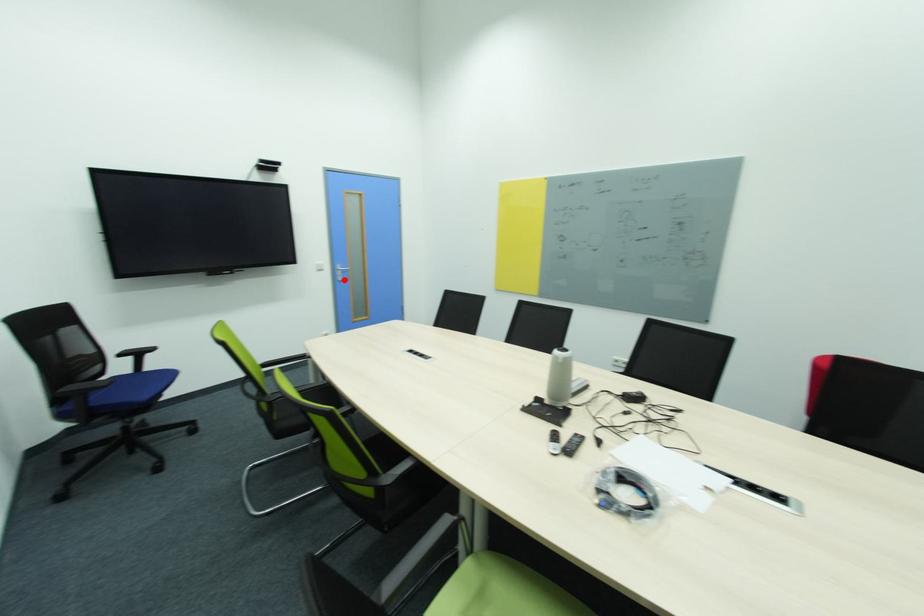
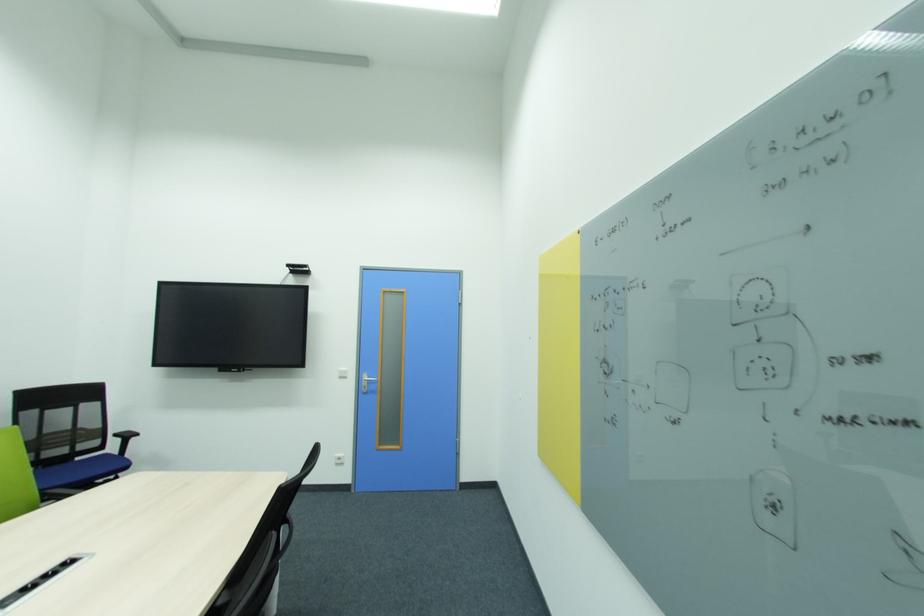
Where in the second image is the point corresponding to the highlighted location from the first image?

(370, 392)